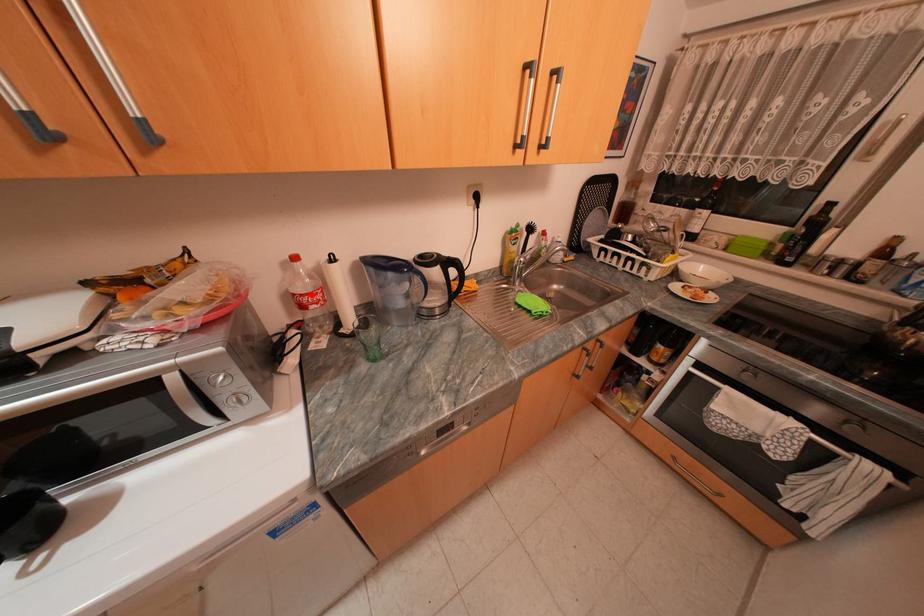
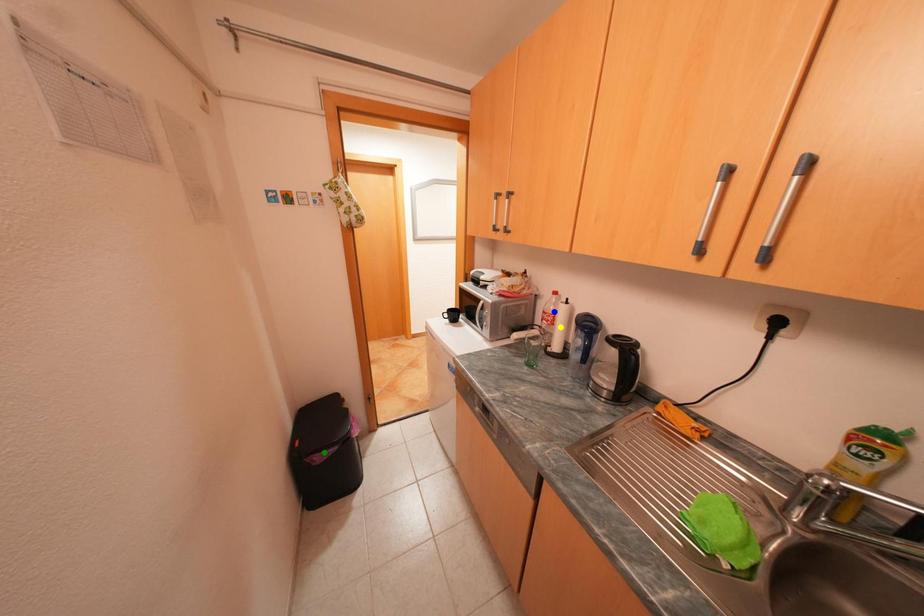
Question: I am providing you with two images of the same scene from different viewpoints. A red point is marked on the first image. You are given multiple points on the second image. Which spot in image 2 lines up with the point in image 1?

Choices:
 (A) blue point
 (B) green point
 (C) yellow point

Answer: (A)